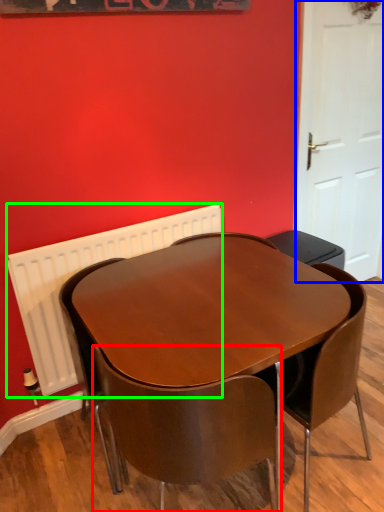
Question: Estimate the real-world distances between objects in this image. Which object is closer to chair (highlighted by a red box), door (highlighted by a blue box) or radiator (highlighted by a green box)?

Choices:
 (A) door
 (B) radiator

Answer: (B)